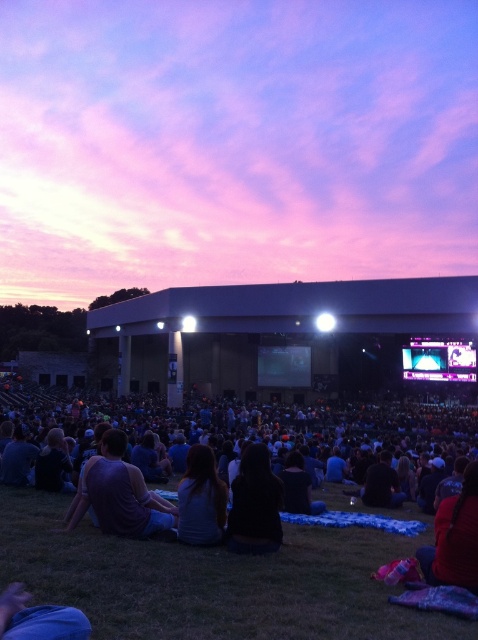
Question: Which point appears closest to the camera in this image?

Choices:
 (A) (261, 512)
 (B) (351, 465)
 (C) (133, 529)
 (D) (468, 490)

Answer: (D)

Question: Does purple matte tank top at lower left appear on the right side of silky brown hair at center?

Choices:
 (A) yes
 (B) no

Answer: (B)

Question: Does silky brown hair at center have a lesser width compared to matte black screen at center?

Choices:
 (A) no
 (B) yes

Answer: (B)

Question: Which point is farther to the camera?

Choices:
 (A) (120, 413)
 (B) (260, 372)
 (C) (458, 493)

Answer: (B)

Question: Can you confirm if red fabric jacket at lower right is positioned above matte black screen at center?

Choices:
 (A) yes
 (B) no

Answer: (A)

Question: Which point is farther from the camera taking this photo?

Choices:
 (A) (167, 522)
 (B) (193, 513)
 (C) (238, 506)

Answer: (A)